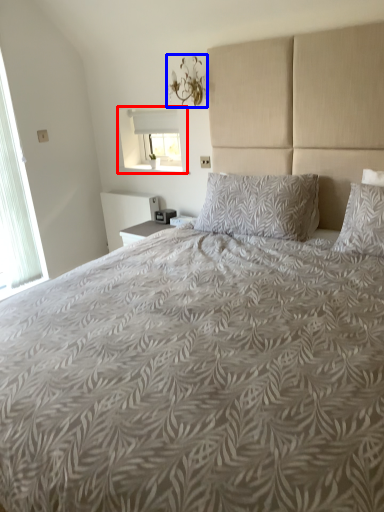
Question: Which object is further to the camera taking this photo, window (highlighted by a red box) or light fixture (highlighted by a blue box)?

Choices:
 (A) window
 (B) light fixture

Answer: (A)